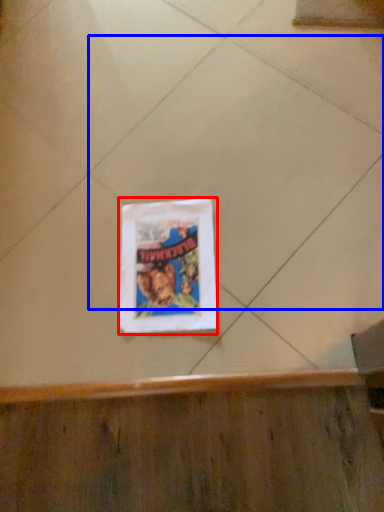
Question: Which of the following is the closest to the observer, picture frame (highlighted by a red box) or ceramic tile (highlighted by a blue box)?

Choices:
 (A) picture frame
 (B) ceramic tile

Answer: (B)